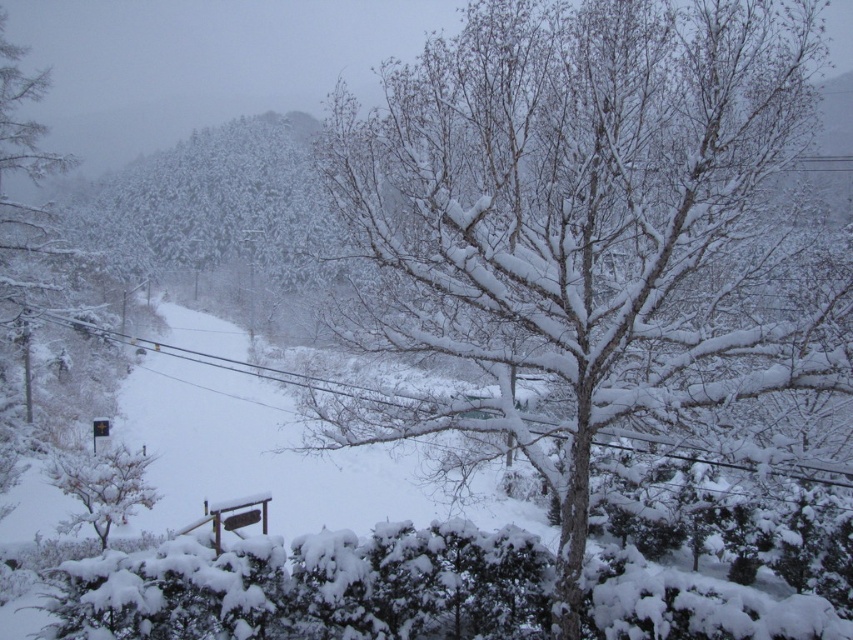
Question: Is snow-covered tree at center smaller than white snow-covered tree at lower left?

Choices:
 (A) no
 (B) yes

Answer: (A)

Question: Can you confirm if snow-covered tree at center is positioned above white snow-covered tree at lower left?

Choices:
 (A) no
 (B) yes

Answer: (B)

Question: Does snow-covered tree at center come behind white snow-covered tree at lower left?

Choices:
 (A) no
 (B) yes

Answer: (A)

Question: Which point is farther to the camera?

Choices:
 (A) (138, 486)
 (B) (840, 371)

Answer: (A)